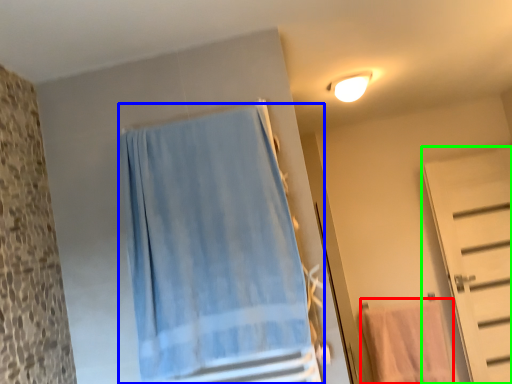
Question: Which object is the closest to the beach towel (highlighted by a red box)? Choose among these: curtain (highlighted by a blue box) or door (highlighted by a green box).

Choices:
 (A) curtain
 (B) door

Answer: (B)